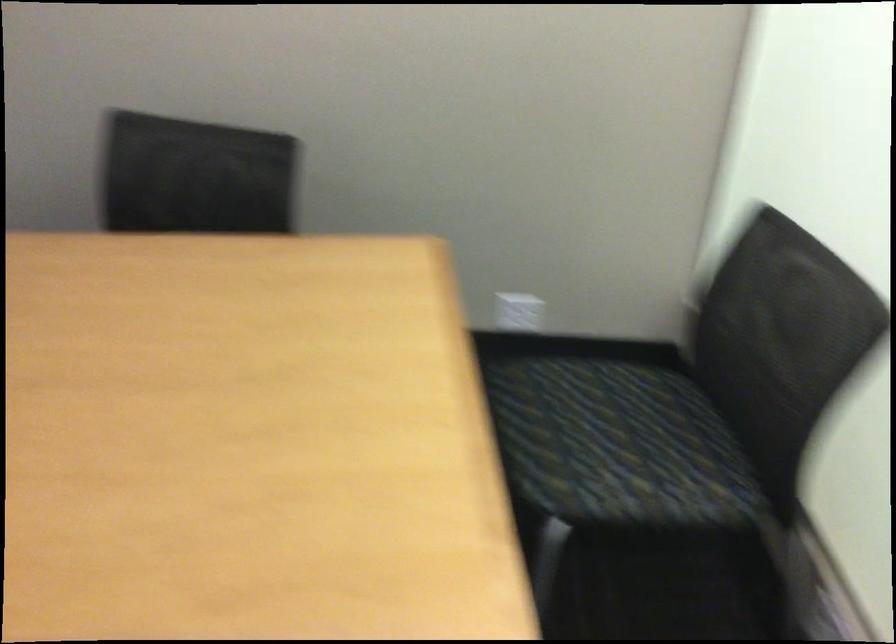
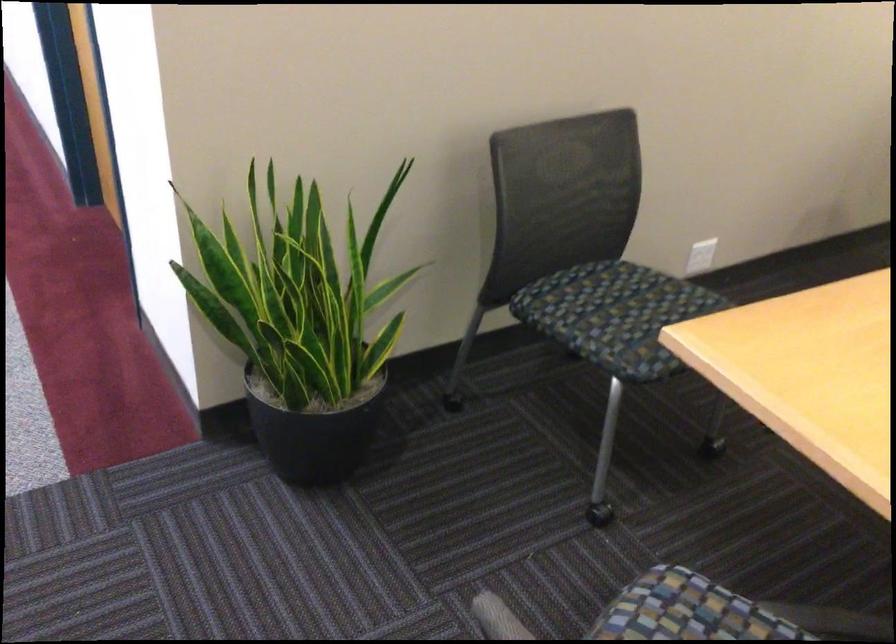
Question: What movement of the cameraman would produce the second image?

Choices:
 (A) Left
 (B) Right
 (C) Forward
 (D) Backward

Answer: (A)